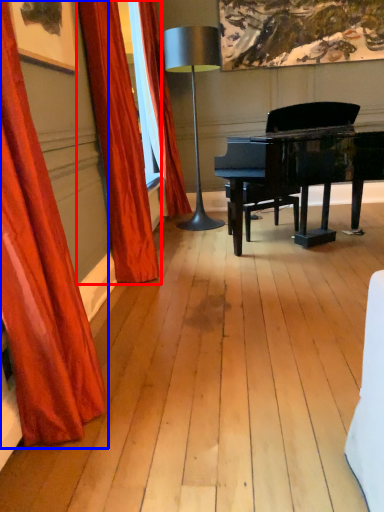
Question: Which object is further to the camera taking this photo, curtain (highlighted by a red box) or curtain (highlighted by a blue box)?

Choices:
 (A) curtain
 (B) curtain

Answer: (A)